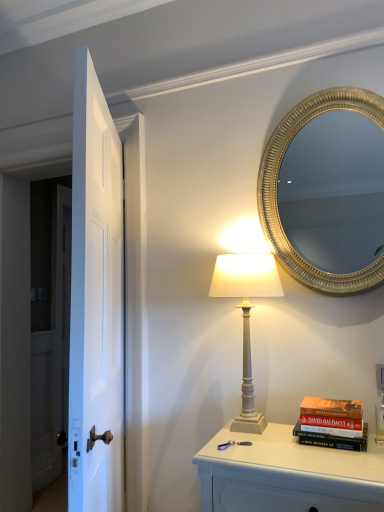
Identify the location of blank space above gold textured mirror at upper right (from a real-world perspective). (321, 88).